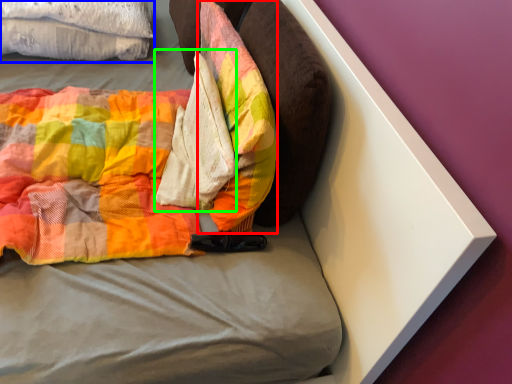
Question: Based on their relative distances, which object is farther from pillow (highlighted by a red box)? Choose from cloth (highlighted by a blue box) and material (highlighted by a green box).

Choices:
 (A) cloth
 (B) material

Answer: (A)